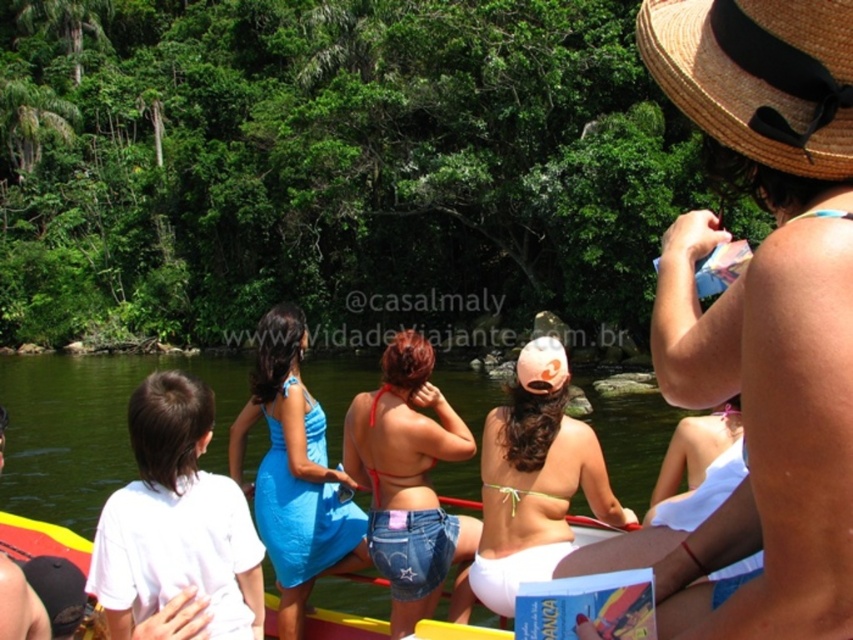
You are standing on the boat and want to reach the point at coordinates point (798, 36). If your maximum reach is 5 meters, can you reach it?

The distance between you and the point (798, 36) is 5.19 meters, which is beyond your maximum reach of 5 meters. You cannot reach it.